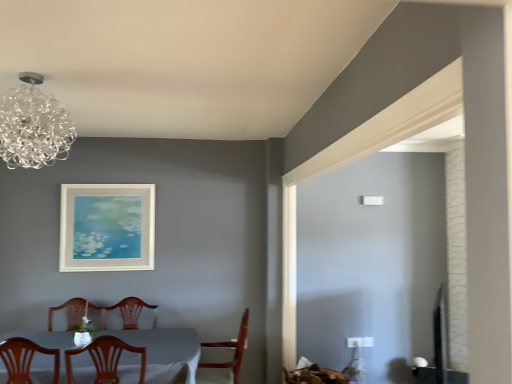
Question: Is white glossy table at lower left at the right side of transparent glass chandelier at upper left?

Choices:
 (A) yes
 (B) no

Answer: (B)

Question: Is white glossy table at lower left beside transparent glass chandelier at upper left?

Choices:
 (A) no
 (B) yes

Answer: (A)

Question: Considering the relative sizes of white glossy table at lower left and transparent glass chandelier at upper left in the image provided, is white glossy table at lower left smaller than transparent glass chandelier at upper left?

Choices:
 (A) yes
 (B) no

Answer: (B)

Question: Could you tell me if white glossy table at lower left is facing transparent glass chandelier at upper left?

Choices:
 (A) no
 (B) yes

Answer: (A)

Question: Is white glossy table at lower left at the left side of transparent glass chandelier at upper left?

Choices:
 (A) no
 (B) yes

Answer: (B)

Question: Considering the relative sizes of white glossy table at lower left and transparent glass chandelier at upper left in the image provided, is white glossy table at lower left shorter than transparent glass chandelier at upper left?

Choices:
 (A) yes
 (B) no

Answer: (B)

Question: From a real-world perspective, is wooden chair at center, the 1th chair when ordered from left to right, over white matte picture frame at upper center?

Choices:
 (A) yes
 (B) no

Answer: (B)

Question: Does wooden chair at center, the 1th chair positioned from the front, have a greater height compared to white matte picture frame at upper center?

Choices:
 (A) yes
 (B) no

Answer: (B)

Question: From a real-world perspective, is wooden chair at center, marked as the 2th chair in a right-to-left arrangement, located beneath white matte picture frame at upper center?

Choices:
 (A) yes
 (B) no

Answer: (A)

Question: Is wooden chair at center, the second chair viewed from the back, not near white matte picture frame at upper center?

Choices:
 (A) no
 (B) yes

Answer: (B)

Question: Is wooden chair at center, the 1th chair positioned from the front, touching white matte picture frame at upper center?

Choices:
 (A) no
 (B) yes

Answer: (A)

Question: Can you confirm if wooden chair at center, the 1th chair when ordered from left to right, is shorter than white matte picture frame at upper center?

Choices:
 (A) no
 (B) yes

Answer: (B)

Question: Can you confirm if wooden chair at center, the second chair viewed from the back, is positioned to the right of white glossy table at lower left?

Choices:
 (A) no
 (B) yes

Answer: (B)